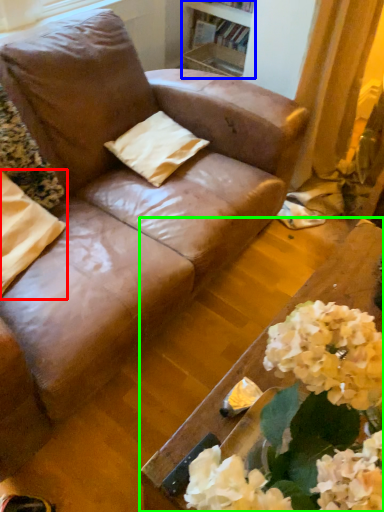
Question: Considering the real-world distances, which object is farthest from pillow (highlighted by a red box)? bookshelf (highlighted by a blue box) or table (highlighted by a green box)?

Choices:
 (A) bookshelf
 (B) table

Answer: (A)